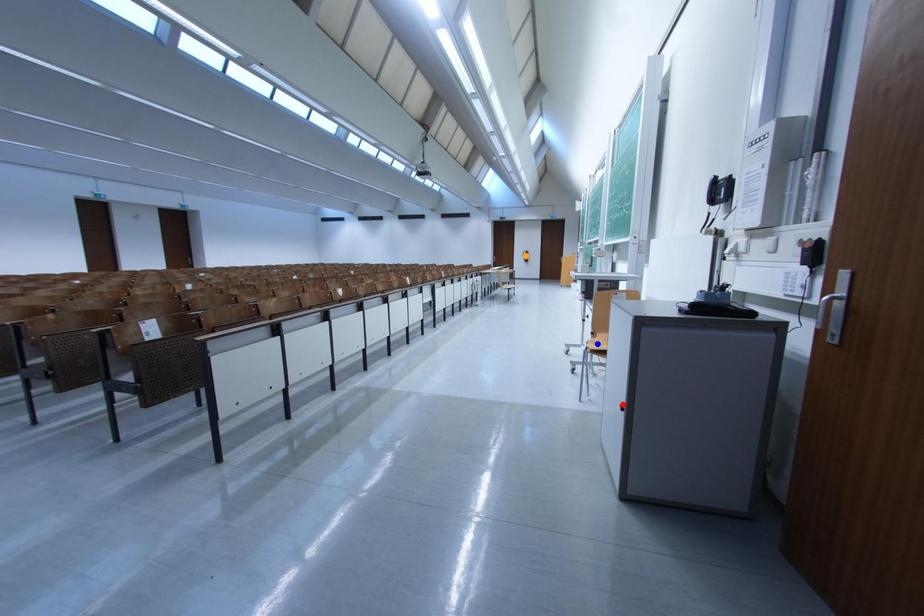
From the picture: Order these from nearest to farthest:
orange point
red point
blue point

red point
blue point
orange point